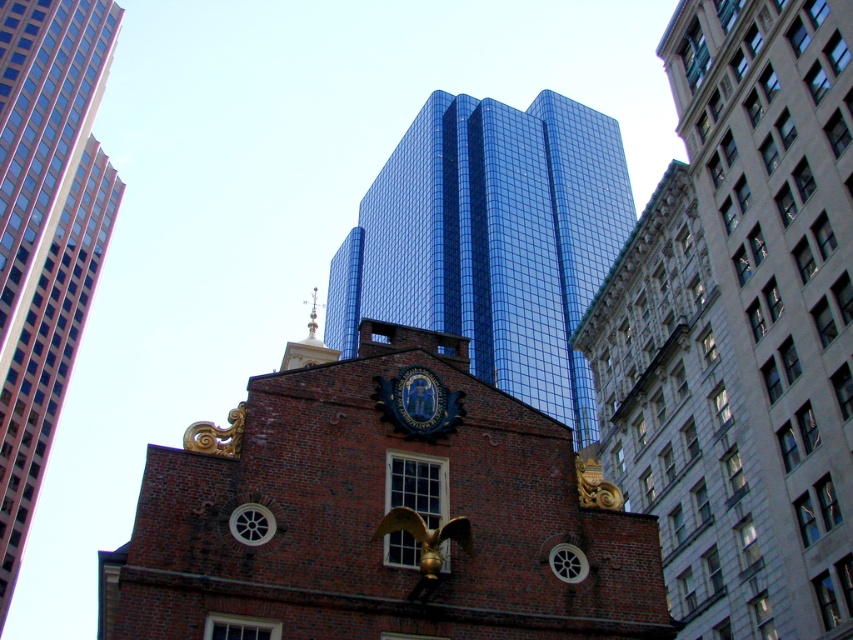
Question: Can you confirm if glossy glass tower at center is positioned to the right of brick bell tower at center?

Choices:
 (A) yes
 (B) no

Answer: (A)

Question: Does glossy glass tower at center have a greater width compared to blue glossy seal at center?

Choices:
 (A) yes
 (B) no

Answer: (A)

Question: Which object is closer to the camera taking this photo?

Choices:
 (A) brown brick building at center
 (B) blue glossy seal at center
 (C) brick bell tower at center
 (D) glossy glass tower at center

Answer: (A)

Question: Does glossy glass tower at center come in front of brick bell tower at center?

Choices:
 (A) yes
 (B) no

Answer: (B)

Question: Which point is farther to the camera?

Choices:
 (A) brick bell tower at center
 (B) glossy glass tower at center
 (C) blue glossy seal at center
 (D) brown brick building at center

Answer: (B)

Question: Estimate the real-world distances between objects in this image. Which object is farther from the glossy glass tower at center?

Choices:
 (A) brick bell tower at center
 (B) brown brick building at center
 (C) blue glossy seal at center

Answer: (C)